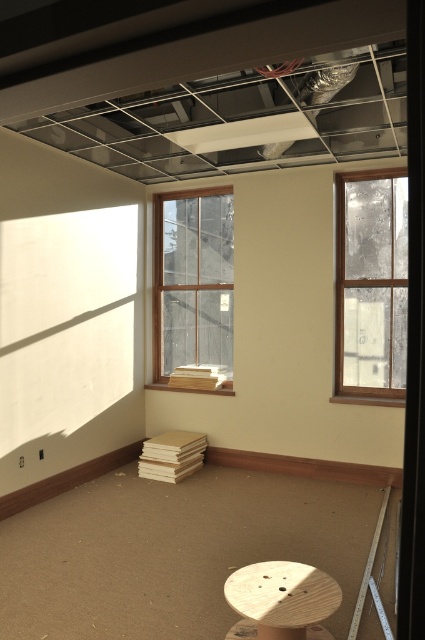
Does clear glass window at center have a smaller size compared to wooden stool at lower center?

No.

Who is shorter, clear glass window at center or wooden stool at lower center?

wooden stool at lower center is shorter.

Identify the location of clear glass window at center. Image resolution: width=425 pixels, height=640 pixels. (193, 285).

Identify the location of clear glass window at center. The image size is (425, 640). (193, 285).

Who is more distant from viewer, (357,208) or (201,288)?

The point (201,288) is more distant.

Is the position of clear glass window at right less distant than that of clear glass window at center?

Yes, it is in front of clear glass window at center.

Is point (367, 381) in front of point (210, 307)?

Yes, point (367, 381) is in front of point (210, 307).

Where is `clear glass window at right`? The width and height of the screenshot is (425, 640). clear glass window at right is located at coordinates (371, 284).

Can you confirm if clear glass window at right is shorter than wooden stool at lower center?

No, clear glass window at right is not shorter than wooden stool at lower center.

Who is lower down, clear glass window at right or wooden stool at lower center?

wooden stool at lower center

What do you see at coordinates (371, 284) in the screenshot? The image size is (425, 640). I see `clear glass window at right` at bounding box center [371, 284].

Find the location of a particular element. The height and width of the screenshot is (640, 425). clear glass window at right is located at coordinates (371, 284).